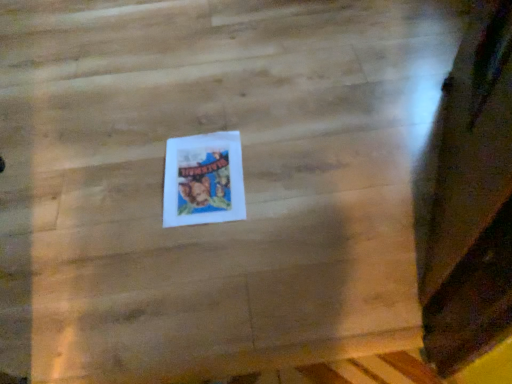
The width and height of the screenshot is (512, 384). I want to click on free space above white paper poster at center (from a real-world perspective), so click(208, 165).